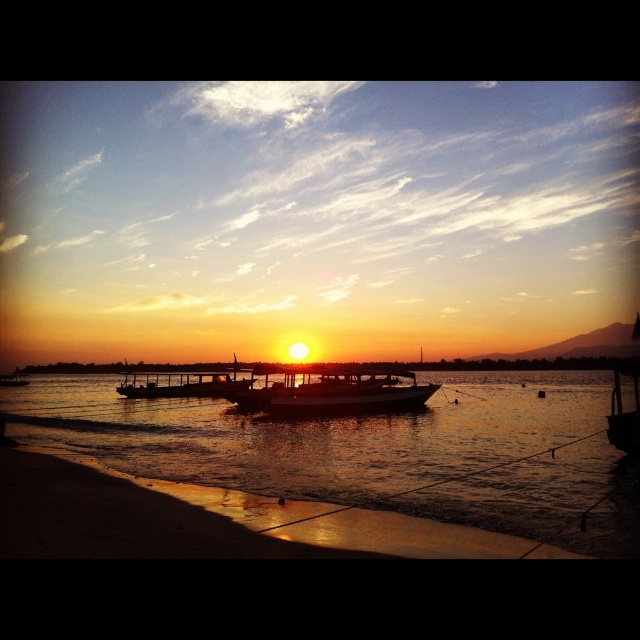
Who is lower down, white matte boat at center or silvery metallic boat at center?

silvery metallic boat at center is below.

Measure the distance from white matte boat at center to silvery metallic boat at center.

A distance of 5.64 meters exists between white matte boat at center and silvery metallic boat at center.

Is point (413, 390) farther from viewer compared to point (211, 381)?

No, it is in front of (211, 381).

At what (x,y) coordinates should I click in order to perform the action: click on white matte boat at center. Please return your answer as a coordinate pair (x, y). Image resolution: width=640 pixels, height=640 pixels. Looking at the image, I should click on (330, 390).

Does translucent water at lower center have a greater height compared to white matte boat at center?

Yes, translucent water at lower center is taller than white matte boat at center.

Is translucent water at lower center thinner than white matte boat at center?

In fact, translucent water at lower center might be wider than white matte boat at center.

Between point (561, 515) and point (244, 388), which one is positioned behind?

The point (244, 388) is more distant.

Where is `translucent water at lower center`? The image size is (640, 640). translucent water at lower center is located at coordinates (372, 451).

Is translucent water at lower center smaller than silvery metallic boat at center?

Correct, translucent water at lower center occupies less space than silvery metallic boat at center.

Is point (44, 413) closer to viewer compared to point (134, 394)?

Yes, point (44, 413) is in front of point (134, 394).

You are a GUI agent. You are given a task and a screenshot of the screen. Output one action in this format:
    pyautogui.click(x=<x>, y=<y>)
    Task: Click on the translucent water at lower center
    
    Given the screenshot: What is the action you would take?
    pyautogui.click(x=372, y=451)